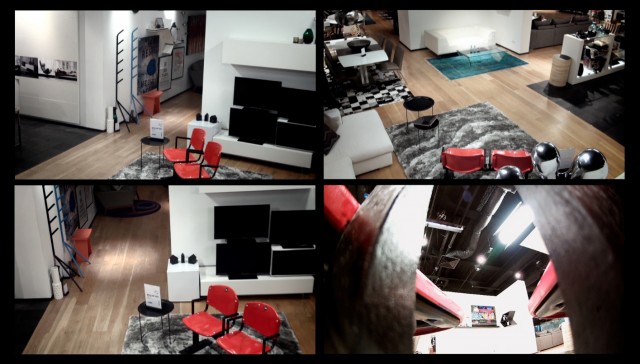
Where is `white couch`? This screenshot has height=364, width=640. white couch is located at coordinates (444, 35).